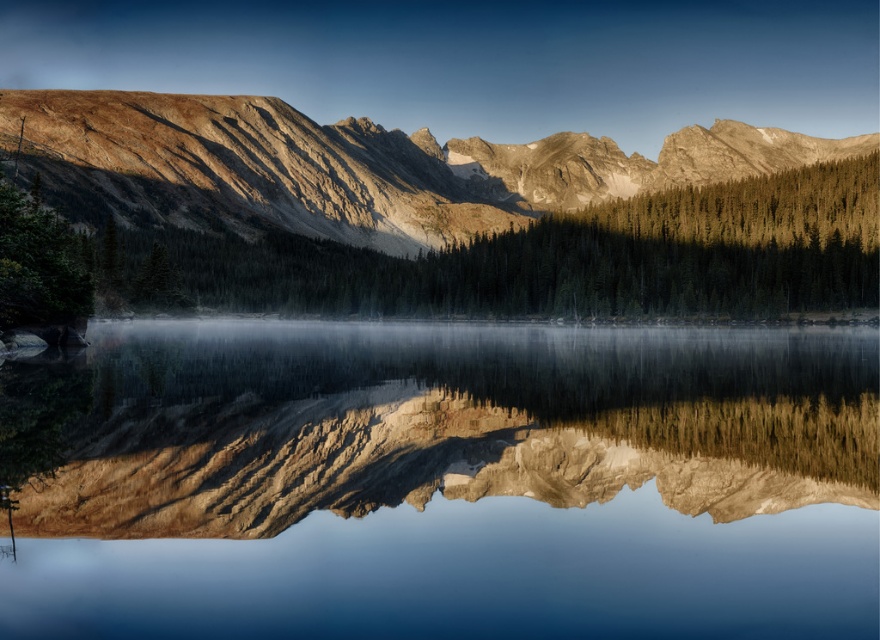
Question: Is smooth reflective water at center positioned behind green matte trees at upper center?

Choices:
 (A) no
 (B) yes

Answer: (A)

Question: Where is rugged stone mountain range at upper center located in relation to green matte trees at upper center in the image?

Choices:
 (A) right
 (B) left

Answer: (A)

Question: Is rugged stone mountain range at upper center below green matte trees at upper center?

Choices:
 (A) no
 (B) yes

Answer: (A)

Question: Estimate the real-world distances between objects in this image. Which object is farther from the green matte trees at upper center?

Choices:
 (A) rugged stone mountain range at upper center
 (B) smooth reflective water at center

Answer: (A)

Question: Considering the real-world distances, which object is farthest from the rugged stone mountain range at upper center?

Choices:
 (A) green matte trees at upper center
 (B) smooth reflective water at center

Answer: (B)

Question: Among these objects, which one is nearest to the camera?

Choices:
 (A) green matte trees at upper center
 (B) rugged stone mountain range at upper center

Answer: (A)